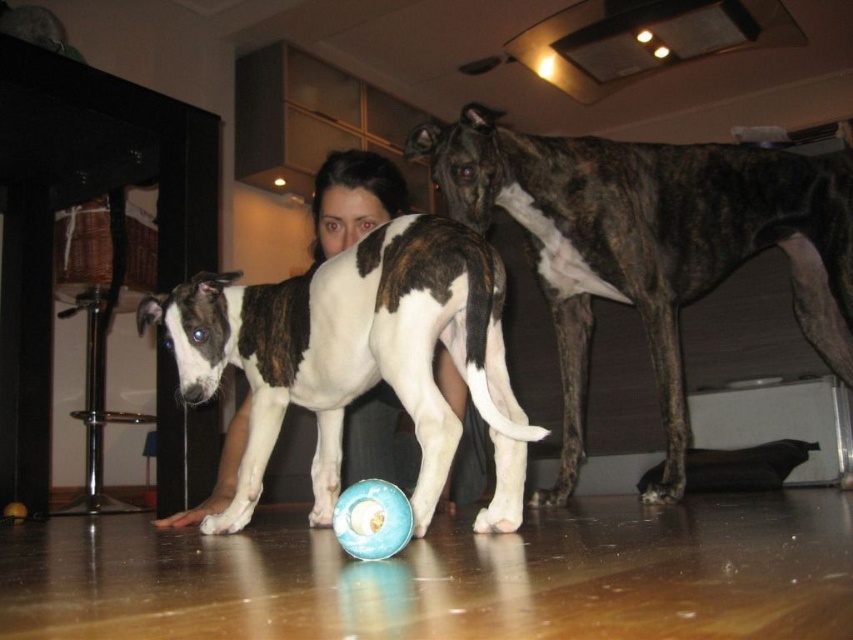
Question: Which point is farther from the camera taking this photo?

Choices:
 (A) (392, 529)
 (B) (343, 396)
 (C) (453, 189)

Answer: (C)

Question: Among these points, which one is farthest from the camera?

Choices:
 (A) (846, 192)
 (B) (383, 492)

Answer: (A)

Question: Can you confirm if brown and white fur at center is positioned to the left of blue rubber ball at center?

Choices:
 (A) yes
 (B) no

Answer: (A)

Question: Does brindle fur dog at center lie in front of blue rubber ball at center?

Choices:
 (A) yes
 (B) no

Answer: (B)

Question: Which point is closer to the camera?

Choices:
 (A) (347, 541)
 (B) (173, 346)
 (C) (650, 337)

Answer: (A)

Question: Is brindle fur dog at center below brown and white fur at center?

Choices:
 (A) yes
 (B) no

Answer: (B)